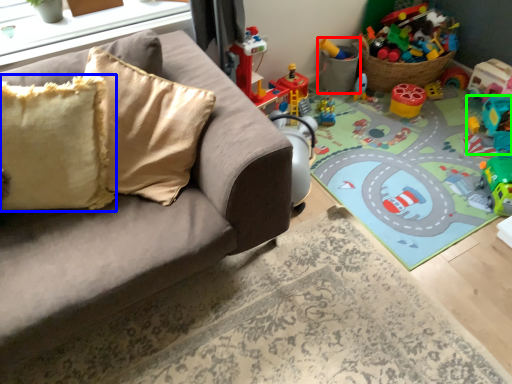
Question: Which object is the farthest from toy (highlighted by a red box)? Choose among these: pillow (highlighted by a blue box) or toy (highlighted by a green box).

Choices:
 (A) pillow
 (B) toy

Answer: (A)